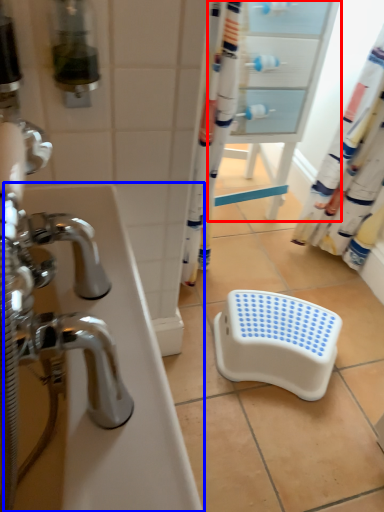
Question: Which point is further to the camera, screen door (highlighted by a red box) or bath (highlighted by a blue box)?

Choices:
 (A) screen door
 (B) bath

Answer: (A)